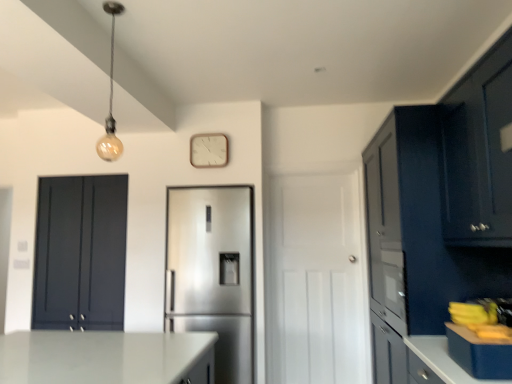
Question: From the image's perspective, would you say matte dark blue cabinet at right, the 2th cabinetry from the right, is shown under matte dark blue cabinet at upper right, which ranks as the 3th cabinetry in back-to-front order?

Choices:
 (A) yes
 (B) no

Answer: (A)

Question: From the image's perspective, would you say matte dark blue cabinet at right, marked as the second cabinetry in a front-to-back arrangement, is positioned over matte dark blue cabinet at upper right, the first cabinetry viewed from the front?

Choices:
 (A) yes
 (B) no

Answer: (B)

Question: Is matte dark blue cabinet at right, marked as the second cabinetry in a left-to-right arrangement, outside of matte dark blue cabinet at upper right, which is the 1th cabinetry from right to left?

Choices:
 (A) no
 (B) yes

Answer: (B)

Question: Is matte dark blue cabinet at right, marked as the second cabinetry in a left-to-right arrangement, next to matte dark blue cabinet at upper right, which ranks as the 3th cabinetry in back-to-front order, and touching it?

Choices:
 (A) no
 (B) yes

Answer: (A)

Question: Is matte dark blue cabinet at upper right, positioned as the 3th cabinetry in left-to-right order, at the back of matte dark blue cabinet at right, marked as the second cabinetry in a left-to-right arrangement?

Choices:
 (A) yes
 (B) no

Answer: (B)

Question: Is matte dark blue cabinet at right, positioned as the 2th cabinetry in back-to-front order, positioned behind matte dark blue cabinet at upper right, which ranks as the 3th cabinetry in back-to-front order?

Choices:
 (A) no
 (B) yes

Answer: (B)

Question: Can you confirm if matte dark blue cabinet at upper right, the first cabinetry viewed from the front, is positioned to the left of matte dark blue cabinet at left, the 1th cabinetry in the left-to-right sequence?

Choices:
 (A) yes
 (B) no

Answer: (B)

Question: Is matte dark blue cabinet at left, which is the third cabinetry from right to left, at the back of matte dark blue cabinet at upper right, positioned as the 3th cabinetry in left-to-right order?

Choices:
 (A) yes
 (B) no

Answer: (B)

Question: Is matte dark blue cabinet at upper right, which is the 1th cabinetry from right to left, closer to the viewer compared to matte dark blue cabinet at left, placed as the third cabinetry when sorted from front to back?

Choices:
 (A) yes
 (B) no

Answer: (A)

Question: From the image's perspective, would you say matte dark blue cabinet at upper right, the first cabinetry viewed from the front, is shown under matte dark blue cabinet at left, the 1th cabinetry in the left-to-right sequence?

Choices:
 (A) yes
 (B) no

Answer: (B)

Question: Does matte dark blue cabinet at upper right, the first cabinetry viewed from the front, come behind matte dark blue cabinet at left, placed as the third cabinetry when sorted from front to back?

Choices:
 (A) yes
 (B) no

Answer: (B)

Question: Could you tell me if matte dark blue cabinet at upper right, which ranks as the 3th cabinetry in back-to-front order, is turned towards matte dark blue cabinet at left, the first cabinetry when ordered from back to front?

Choices:
 (A) yes
 (B) no

Answer: (A)

Question: Is matte glass bulb at upper left far away from wooden clock at upper center?

Choices:
 (A) no
 (B) yes

Answer: (A)